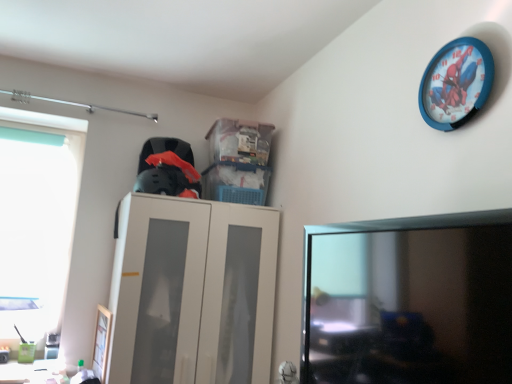
Question: Can you confirm if blue plastic wall clock at upper right is wider than black glossy monitor at lower right?

Choices:
 (A) yes
 (B) no

Answer: (B)

Question: Is blue plastic wall clock at upper right completely or partially outside of black glossy monitor at lower right?

Choices:
 (A) yes
 (B) no

Answer: (A)

Question: Is blue plastic wall clock at upper right oriented away from black glossy monitor at lower right?

Choices:
 (A) yes
 (B) no

Answer: (B)

Question: Does blue plastic wall clock at upper right have a lesser height compared to black glossy monitor at lower right?

Choices:
 (A) no
 (B) yes

Answer: (B)

Question: Considering the relative positions of blue plastic wall clock at upper right and black glossy monitor at lower right in the image provided, is blue plastic wall clock at upper right to the left of black glossy monitor at lower right from the viewer's perspective?

Choices:
 (A) no
 (B) yes

Answer: (A)

Question: In terms of size, does black glossy monitor at lower right appear bigger or smaller than transparent plastic window at left?

Choices:
 (A) small
 (B) big

Answer: (B)

Question: In terms of height, does black glossy monitor at lower right look taller or shorter compared to transparent plastic window at left?

Choices:
 (A) short
 (B) tall

Answer: (A)

Question: Is black glossy monitor at lower right wider or thinner than transparent plastic window at left?

Choices:
 (A) wide
 (B) thin

Answer: (A)

Question: Would you say black glossy monitor at lower right is to the left or to the right of transparent plastic window at left in the picture?

Choices:
 (A) left
 (B) right

Answer: (B)

Question: Looking at their shapes, would you say transparent plastic window at left is wider or thinner than wooden picture frame at lower left?

Choices:
 (A) thin
 (B) wide

Answer: (B)

Question: From their relative heights in the image, would you say transparent plastic window at left is taller or shorter than wooden picture frame at lower left?

Choices:
 (A) short
 (B) tall

Answer: (B)

Question: Based on their sizes in the image, would you say transparent plastic window at left is bigger or smaller than wooden picture frame at lower left?

Choices:
 (A) small
 (B) big

Answer: (B)

Question: Does point (59, 258) appear closer or farther from the camera than point (98, 367)?

Choices:
 (A) farther
 (B) closer

Answer: (A)

Question: Is beige matte cabinet at center wider or thinner than black glossy monitor at lower right?

Choices:
 (A) wide
 (B) thin

Answer: (A)

Question: Which is correct: beige matte cabinet at center is inside black glossy monitor at lower right, or outside of it?

Choices:
 (A) inside
 (B) outside

Answer: (B)